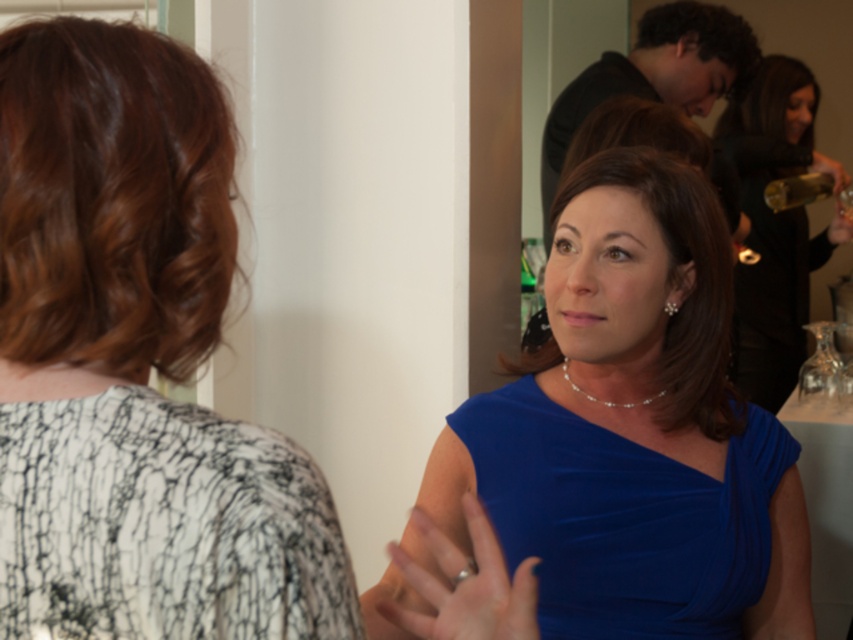
Is point (24, 120) more distant than point (61, 481)?

Yes, it is.

Which is above, white lace blouse at upper left or white textured dress at upper left?

white lace blouse at upper left

Does point (267, 625) come behind point (195, 616)?

Yes, it is.

At what (x,y) coordinates should I click in order to perform the action: click on white lace blouse at upper left. Please return your answer as a coordinate pair (x, y). Looking at the image, I should click on point(135,364).

Is blue velvet dress at center smaller than transparent glass wine glass at right?

No.

Is point (704, 300) closer to camera compared to point (809, 385)?

Yes, it is in front of point (809, 385).

Describe the element at coordinates (627, 429) in the screenshot. I see `blue velvet dress at center` at that location.

Locate an element on the screen. blue velvet dress at center is located at coordinates (627, 429).

Does satin blue dress at center have a smaller size compared to blue satin dress at center?

Correct, satin blue dress at center occupies less space than blue satin dress at center.

Who is more distant from viewer, (508, 396) or (817, 260)?

Positioned behind is point (817, 260).

What do you see at coordinates (624, 516) in the screenshot? I see `satin blue dress at center` at bounding box center [624, 516].

Find the location of `satin blue dress at center`. satin blue dress at center is located at coordinates (624, 516).